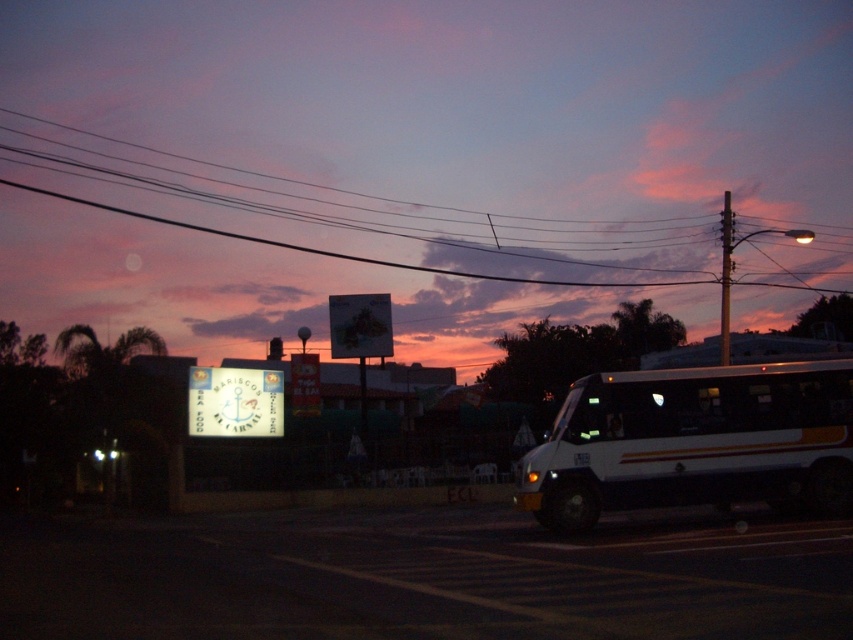
Is matte pink sky at upper center behind white matte bus at center?

Yes, matte pink sky at upper center is behind white matte bus at center.

Based on the photo, is matte pink sky at upper center to the left of white matte bus at center from the viewer's perspective?

Correct, you'll find matte pink sky at upper center to the left of white matte bus at center.

The image size is (853, 640). In order to click on matte pink sky at upper center in this screenshot , I will do `click(413, 161)`.

At what (x,y) coordinates should I click in order to perform the action: click on matte pink sky at upper center. Please return your answer as a coordinate pair (x, y). Looking at the image, I should click on (413, 161).